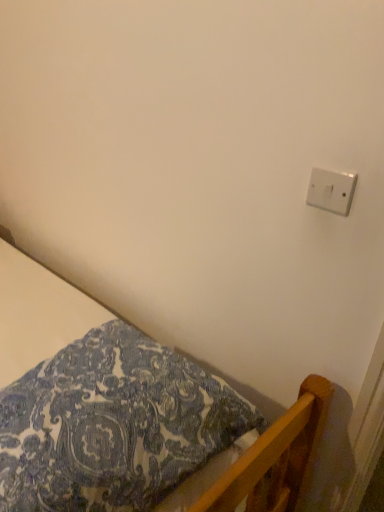
Question: From a real-world perspective, relative to white plastic light switch at upper right, is patterned fabric bed at lower left vertically above or below?

Choices:
 (A) above
 (B) below

Answer: (B)

Question: Looking at the image, does patterned fabric bed at lower left seem bigger or smaller compared to white plastic light switch at upper right?

Choices:
 (A) big
 (B) small

Answer: (A)

Question: Based on their positions, is patterned fabric bed at lower left located to the left or right of white plastic light switch at upper right?

Choices:
 (A) left
 (B) right

Answer: (A)

Question: From a real-world perspective, is white plastic light switch at upper right positioned above or below patterned fabric bed at lower left?

Choices:
 (A) above
 (B) below

Answer: (A)

Question: Considering the positions of white plastic light switch at upper right and patterned fabric bed at lower left in the image, is white plastic light switch at upper right wider or thinner than patterned fabric bed at lower left?

Choices:
 (A) thin
 (B) wide

Answer: (A)

Question: Is white plastic light switch at upper right taller or shorter than patterned fabric bed at lower left?

Choices:
 (A) short
 (B) tall

Answer: (A)

Question: Is point (337, 179) closer or farther from the camera than point (59, 330)?

Choices:
 (A) farther
 (B) closer

Answer: (B)